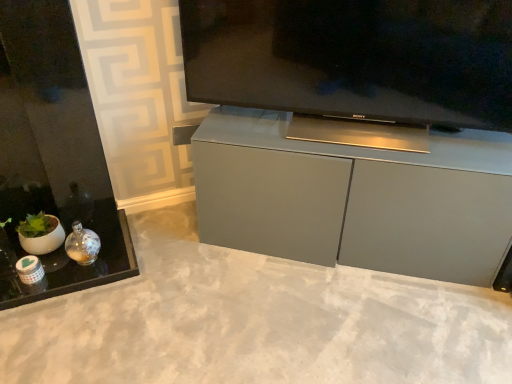
The image size is (512, 384). In order to click on vacant space underneath satin silver television at center (from a real-world perspective) in this screenshot , I will do `click(327, 137)`.